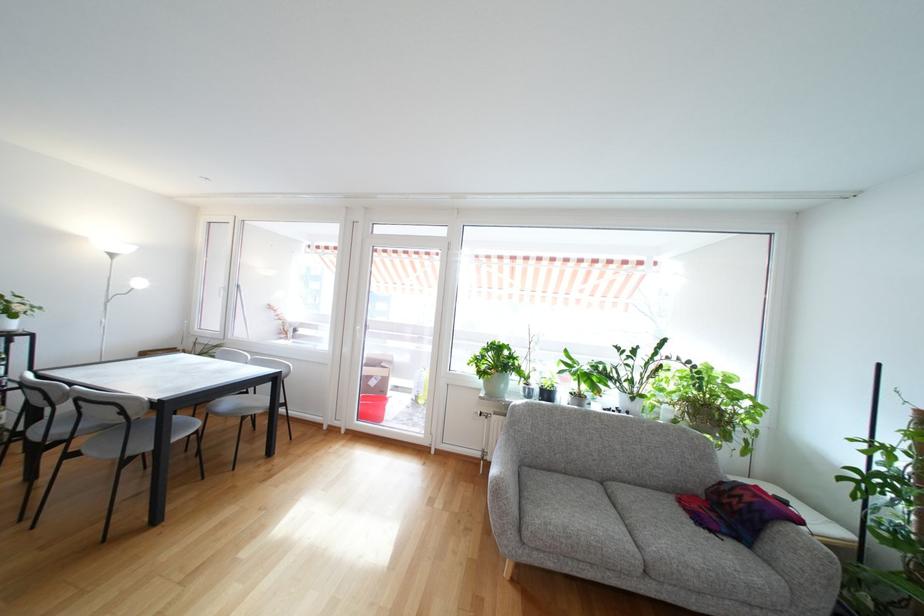
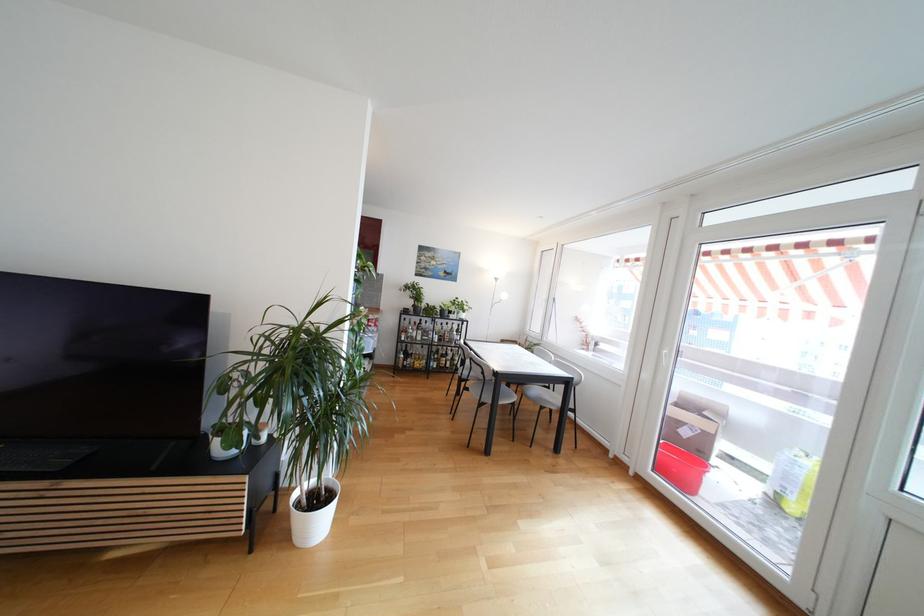
Locate, in the second image, the point that corresponds to (190,429) in the first image.

(513, 399)